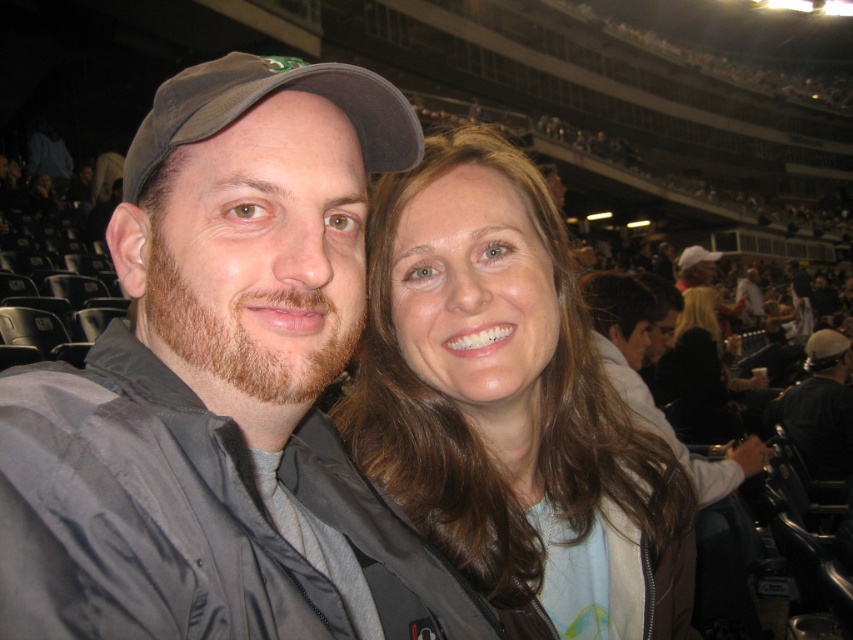
Question: Which object appears farthest from the camera in this image?

Choices:
 (A) black leather jacket at lower right
 (B) matte gray jacket at center
 (C) smooth brown hair at center

Answer: (A)

Question: Where is matte gray jacket at center located in relation to smooth brown hair at center in the image?

Choices:
 (A) right
 (B) left

Answer: (B)

Question: Is smooth brown hair at center bigger than black leather jacket at lower right?

Choices:
 (A) yes
 (B) no

Answer: (A)

Question: Among these points, which one is nearest to the camera?

Choices:
 (A) (834, 381)
 (B) (631, 518)
 (C) (409, 129)

Answer: (C)

Question: Can you confirm if smooth brown hair at center is smaller than black leather jacket at lower right?

Choices:
 (A) no
 (B) yes

Answer: (A)

Question: Which object appears farthest from the camera in this image?

Choices:
 (A) matte gray jacket at center
 (B) black leather jacket at lower right

Answer: (B)